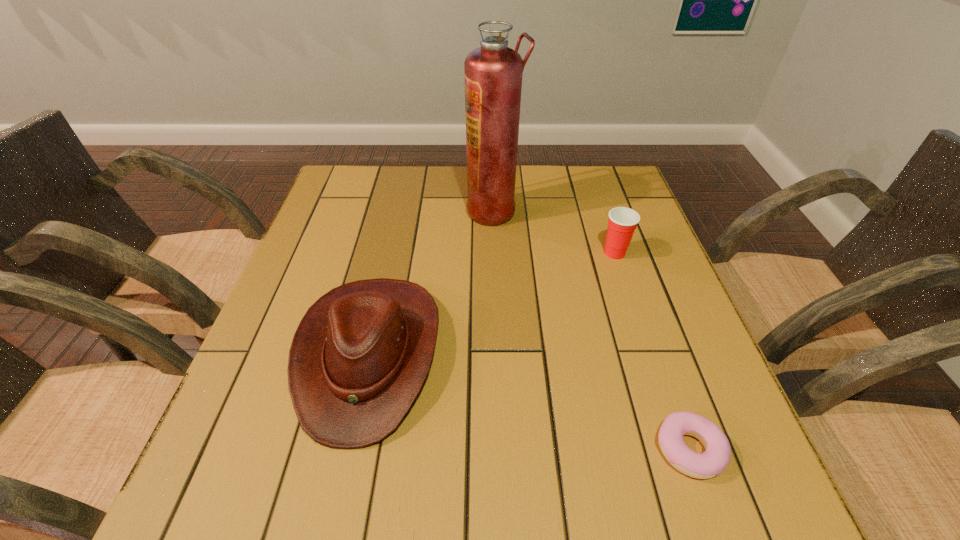
Where is `free space between the leftmost object and the pastry`? This screenshot has width=960, height=540. free space between the leftmost object and the pastry is located at coordinates (529, 402).

Identify the location of free point between the third object from right to left and the leftmost object. (431, 282).

Where is `free space between the pastry and the leftmost object`? This screenshot has height=540, width=960. free space between the pastry and the leftmost object is located at coordinates (529, 402).

Locate an element on the screen. The height and width of the screenshot is (540, 960). object that is the third closest to the tallest object is located at coordinates (714, 460).

This screenshot has width=960, height=540. In order to click on object that is the nearest to the leftmost object in this screenshot , I will do pyautogui.click(x=493, y=72).

The image size is (960, 540). Identify the location of free space that satisfies the following two spatial constraints: 1. on the side of the farthest object with the label; 2. on the back side of the Dixie cup. (495, 253).

In order to click on free space that satisfies the following two spatial constraints: 1. on the back side of the third nearest object; 2. on the side of the fire extinguisher with the label in this screenshot , I will do `click(601, 211)`.

The height and width of the screenshot is (540, 960). What are the coordinates of `vacant region that satisfies the following two spatial constraints: 1. on the side of the third object from right to left with the label; 2. on the right side of the shortest object` in the screenshot? It's located at (503, 449).

Where is `vacant space that satisfies the following two spatial constraints: 1. on the side of the tallest object with the label; 2. on the right side of the pastry`? The height and width of the screenshot is (540, 960). vacant space that satisfies the following two spatial constraints: 1. on the side of the tallest object with the label; 2. on the right side of the pastry is located at coordinates (503, 449).

Locate an element on the screen. This screenshot has width=960, height=540. blank space that satisfies the following two spatial constraints: 1. on the front-facing side of the pastry; 2. on the left side of the cowboy hat is located at coordinates (348, 449).